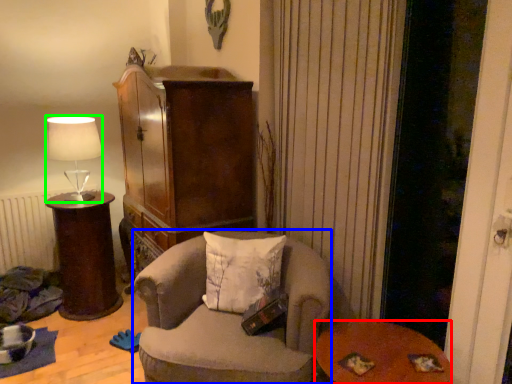
Question: Based on their relative distances, which object is nearer to table (highlighted by a red box)? Choose from chair (highlighted by a blue box) and lamp (highlighted by a green box).

Choices:
 (A) chair
 (B) lamp

Answer: (A)